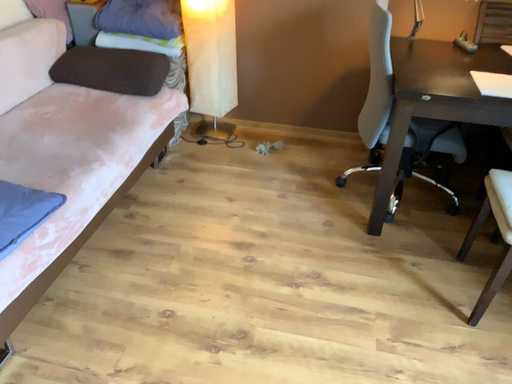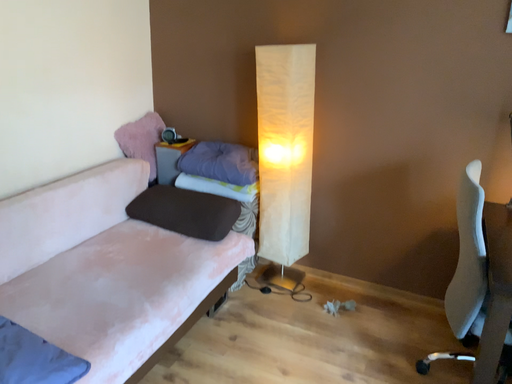
Question: How did the camera likely rotate when shooting the video?

Choices:
 (A) rotated left
 (B) rotated right

Answer: (A)